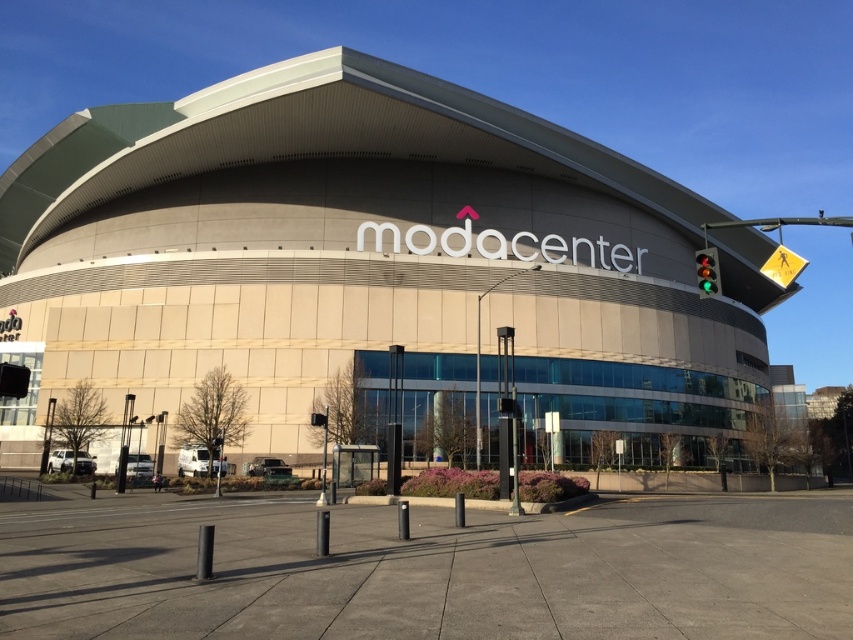
Question: Does beige/textured building at center appear on the right side of green glass traffic light at right?

Choices:
 (A) yes
 (B) no

Answer: (B)

Question: Is beige/textured building at center positioned before green glass traffic light at right?

Choices:
 (A) no
 (B) yes

Answer: (A)

Question: Which object is closer to the camera taking this photo?

Choices:
 (A) beige/textured building at center
 (B) green glass traffic light at right

Answer: (B)

Question: Which point is farther from the camera taking this photo?

Choices:
 (A) (730, 433)
 (B) (697, 280)

Answer: (B)

Question: Which point is farther to the camera?

Choices:
 (A) (302, 413)
 (B) (699, 282)

Answer: (A)

Question: In this image, where is beige/textured building at center located relative to green glass traffic light at right?

Choices:
 (A) right
 (B) left

Answer: (B)